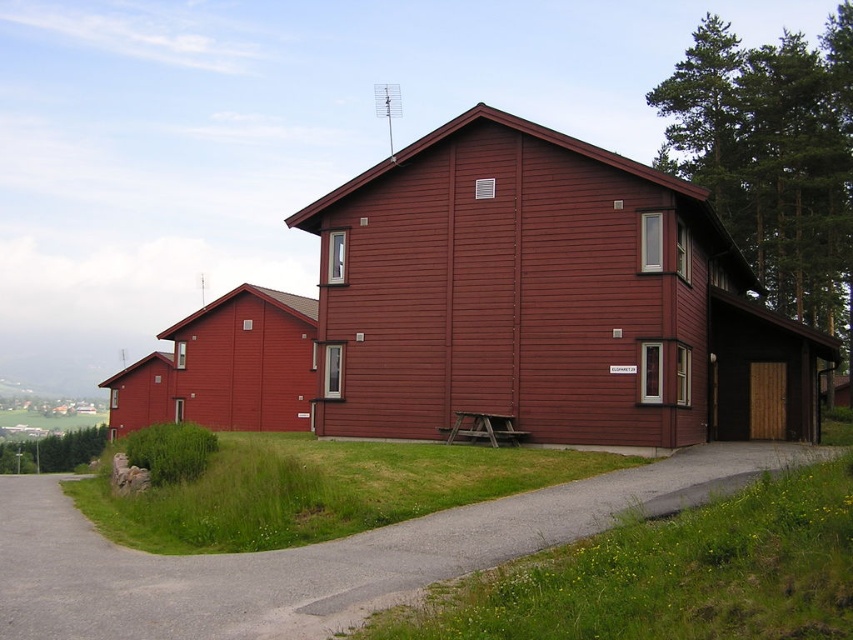
Can you confirm if matte wood barn at center is shorter than gray asphalt driveway at lower left?

No, matte wood barn at center is not shorter than gray asphalt driveway at lower left.

Who is more forward, (x=740, y=262) or (x=28, y=492)?

Positioned in front is point (x=28, y=492).

The width and height of the screenshot is (853, 640). Identify the location of matte wood barn at center. (543, 300).

Image resolution: width=853 pixels, height=640 pixels. What are the coordinates of `matte wood barn at center` in the screenshot? It's located at (543, 300).